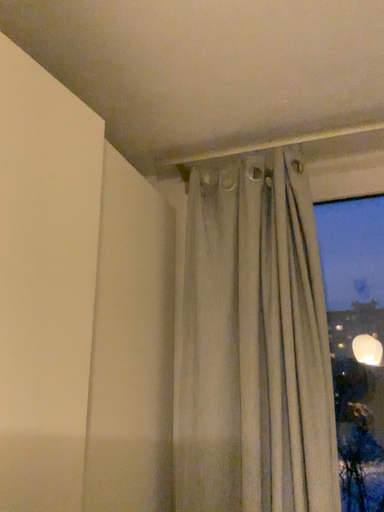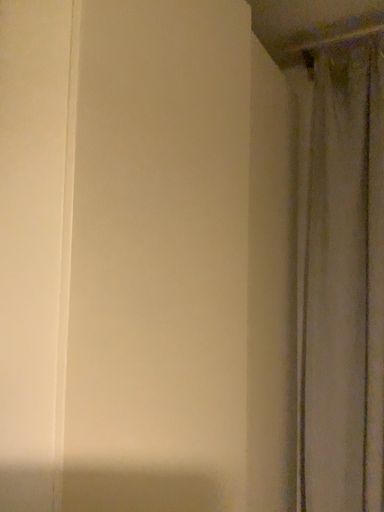
Question: How did the camera likely rotate when shooting the video?

Choices:
 (A) rotated left
 (B) rotated right

Answer: (A)